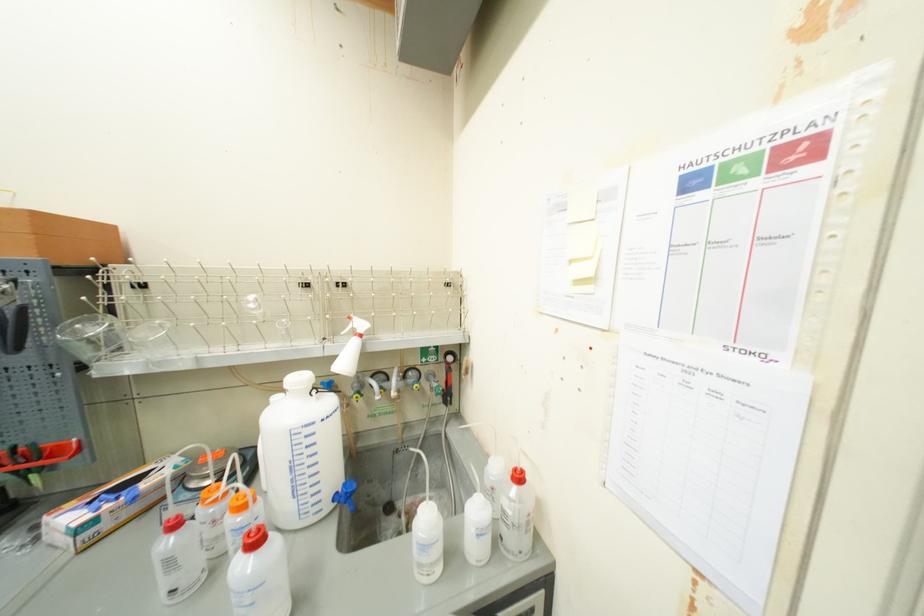
The image size is (924, 616). I want to click on blue spigot handle, so click(x=346, y=493).